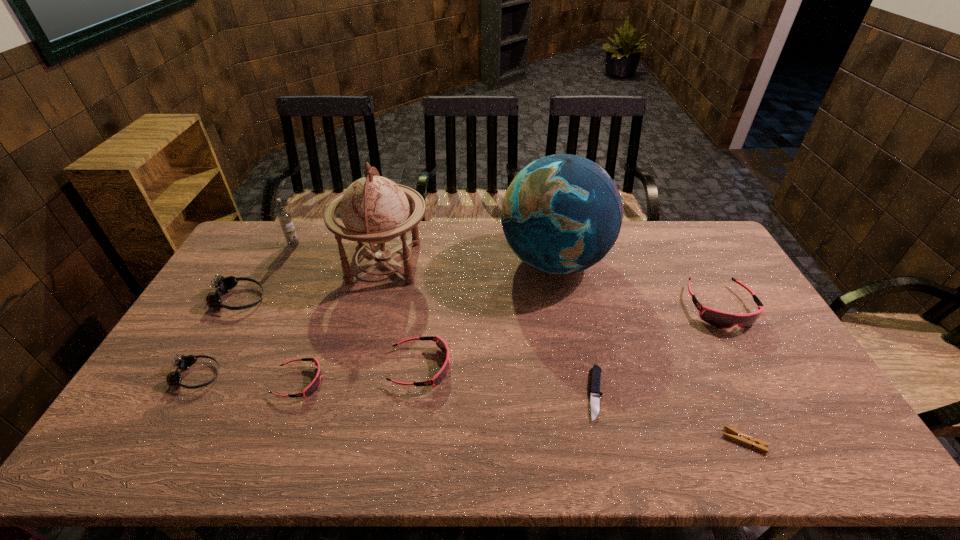
Locate an element on the screen. Image resolution: width=960 pixels, height=540 pixels. empty space between the vodka and the nearer bronze goggles is located at coordinates (245, 310).

In order to click on free space between the nearer bronze goggles and the farther bronze goggles in this screenshot , I will do `click(218, 338)`.

Find the location of a particular element. This screenshot has height=540, width=960. the fourth closest object relative to the right globe is located at coordinates (x=595, y=392).

Choose which object is the third nearest neighbor to the rightmost goggles. Please provide its 2D coordinates. Your answer should be formatted as a tuple, i.e. [(x, y)], where the tuple contains the x and y coordinates of a point satisfying the conditions above.

[(595, 392)]

At what (x,y) coordinates should I click in order to perform the action: click on goggles that stands as the second closest to the rightmost goggles. Please return your answer as a coordinate pair (x, y). Looking at the image, I should click on (312, 388).

Identify which goggles is located as the nearest to the leftmost pink goggles. Please provide its 2D coordinates. Your answer should be formatted as a tuple, i.e. [(x, y)], where the tuple contains the x and y coordinates of a point satisfying the conditions above.

[(183, 362)]

Select which pink goggles appears as the second closest to the blue globe. Please provide its 2D coordinates. Your answer should be formatted as a tuple, i.e. [(x, y)], where the tuple contains the x and y coordinates of a point satisfying the conditions above.

[(441, 344)]

Identify the location of pink goggles identified as the closest to the left globe. Image resolution: width=960 pixels, height=540 pixels. (441, 344).

Identify the location of free space that satisfies the following two spatial constraints: 1. on the back side of the steak knife; 2. at the front of the left globe showing Africa. The height and width of the screenshot is (540, 960). (566, 262).

Where is `blank area in the image that satisfies the following two spatial constraints: 1. on the label of the vodka; 2. on the right side of the right globe`? This screenshot has width=960, height=540. blank area in the image that satisfies the following two spatial constraints: 1. on the label of the vodka; 2. on the right side of the right globe is located at coordinates (285, 261).